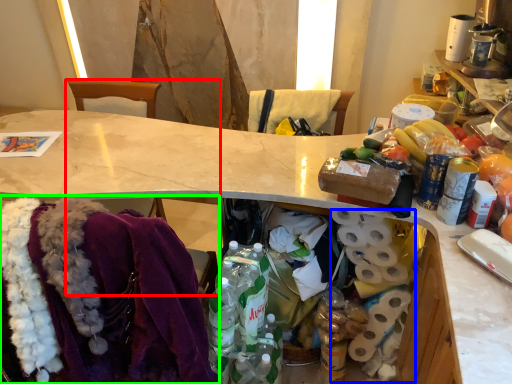
Question: Estimate the real-world distances between objects in this image. Which object is farther from chair (highlighted by a red box), toilet paper (highlighted by a blue box) or clothing (highlighted by a green box)?

Choices:
 (A) toilet paper
 (B) clothing

Answer: (A)